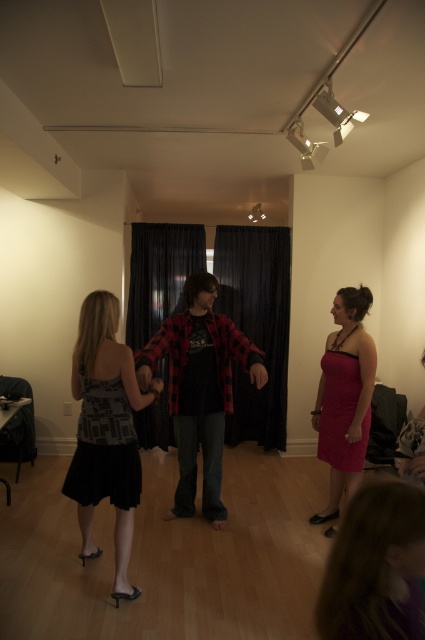
Question: Can you confirm if red plaid shirt at center is positioned to the left of matte pink dress at right?

Choices:
 (A) no
 (B) yes

Answer: (B)

Question: Is black satin dress at left in front of red plaid shirt at center?

Choices:
 (A) no
 (B) yes

Answer: (B)

Question: Among these points, which one is nearest to the camera?

Choices:
 (A) (212, 524)
 (B) (93, 348)

Answer: (B)

Question: Which point is farther from the camera taking this photo?

Choices:
 (A) (121, 432)
 (B) (351, 317)

Answer: (B)

Question: Can you confirm if black satin dress at left is positioned above matte pink dress at right?

Choices:
 (A) yes
 (B) no

Answer: (B)

Question: Estimate the real-world distances between objects in this image. Which object is closer to the black satin dress at left?

Choices:
 (A) matte pink dress at right
 (B) red plaid shirt at center

Answer: (B)